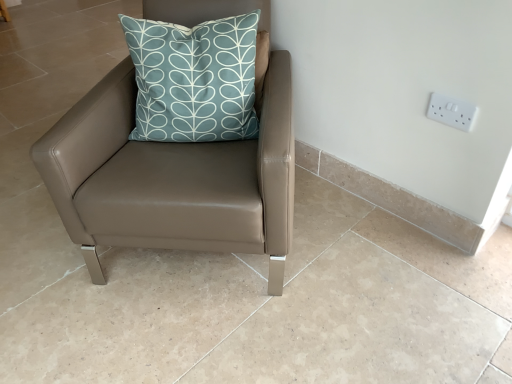
Question: Is teal fabric cushion at upper center at the left side of white plastic electric outlet at upper right?

Choices:
 (A) yes
 (B) no

Answer: (A)

Question: From a real-world perspective, is teal fabric cushion at upper center positioned over white plastic electric outlet at upper right based on gravity?

Choices:
 (A) yes
 (B) no

Answer: (A)

Question: Does teal fabric cushion at upper center contain white plastic electric outlet at upper right?

Choices:
 (A) yes
 (B) no

Answer: (B)

Question: Is teal fabric cushion at upper center further to the viewer compared to white plastic electric outlet at upper right?

Choices:
 (A) no
 (B) yes

Answer: (A)

Question: Is teal fabric cushion at upper center oriented towards white plastic electric outlet at upper right?

Choices:
 (A) no
 (B) yes

Answer: (A)

Question: Would you say white plastic electric outlet at upper right is to the left or to the right of matte brown leather chair at center in the picture?

Choices:
 (A) right
 (B) left

Answer: (A)

Question: Considering the positions of white plastic electric outlet at upper right and matte brown leather chair at center in the image, is white plastic electric outlet at upper right bigger or smaller than matte brown leather chair at center?

Choices:
 (A) small
 (B) big

Answer: (A)

Question: In terms of width, does white plastic electric outlet at upper right look wider or thinner when compared to matte brown leather chair at center?

Choices:
 (A) wide
 (B) thin

Answer: (B)

Question: From the image's perspective, relative to matte brown leather chair at center, is white plastic electric outlet at upper right above or below?

Choices:
 (A) below
 (B) above

Answer: (B)

Question: Based on their positions, is white plastic electric outlet at upper right located to the left or right of teal fabric cushion at upper center?

Choices:
 (A) right
 (B) left

Answer: (A)

Question: Is white plastic electric outlet at upper right taller or shorter than teal fabric cushion at upper center?

Choices:
 (A) short
 (B) tall

Answer: (A)

Question: From the image's perspective, is white plastic electric outlet at upper right positioned above or below teal fabric cushion at upper center?

Choices:
 (A) above
 (B) below

Answer: (B)

Question: Does point (458, 120) appear closer or farther from the camera than point (181, 67)?

Choices:
 (A) closer
 (B) farther

Answer: (A)

Question: Do you think teal fabric cushion at upper center is within white plastic electric outlet at upper right, or outside of it?

Choices:
 (A) outside
 (B) inside

Answer: (A)

Question: Visually, is teal fabric cushion at upper center positioned to the left or to the right of white plastic electric outlet at upper right?

Choices:
 (A) left
 (B) right

Answer: (A)